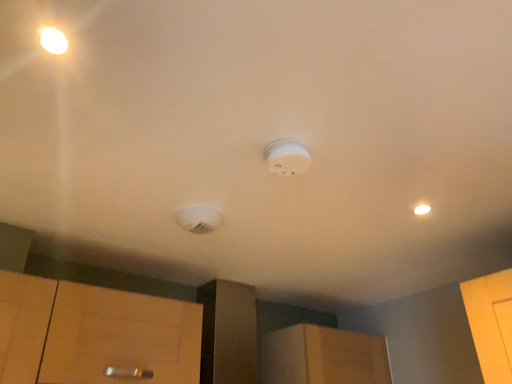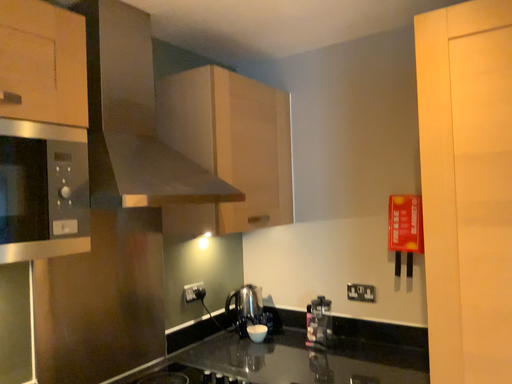
Question: Which way did the camera rotate in the video?

Choices:
 (A) rotated downward
 (B) rotated upward

Answer: (A)